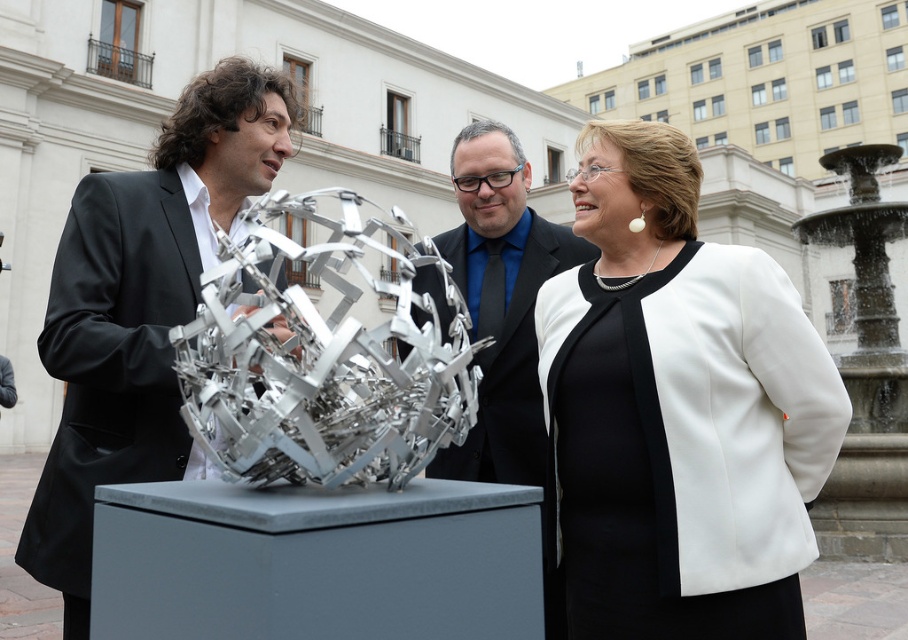
You are a photographer trying to capture a photo of both the white matte blazer at center and the shiny silver sculpture at center in the same frame. Given that your camera has a maximum focus range of 2.5 meters, will you be able to include both objects in focus without moving the camera?

The white matte blazer at center and the shiny silver sculpture at center are 2.66 meters apart from each other. Since the camera can only focus within 2.5 meters, the distance between them exceeds the maximum focus range. Therefore, you cannot capture both in focus simultaneously without adjusting your position or equipment.

You are a photographer trying to capture a wide shot of the scene. Given that the white matte blazer at center and the shiny silver sculpture at center are both in the frame, which object would require a smaller area in your photo to fully capture?

The white matte blazer at center occupies less space than the shiny silver sculpture at center, so it would require a smaller area in the photo to fully capture.

You are a photographer setting up a shot of the white matte blazer at center and the shiny silver sculpture at center. Which object should you focus on first if you want to capture the taller one in your frame?

The shiny silver sculpture at center is taller than the white matte blazer at center, so you should focus on the shiny silver sculpture at center first.